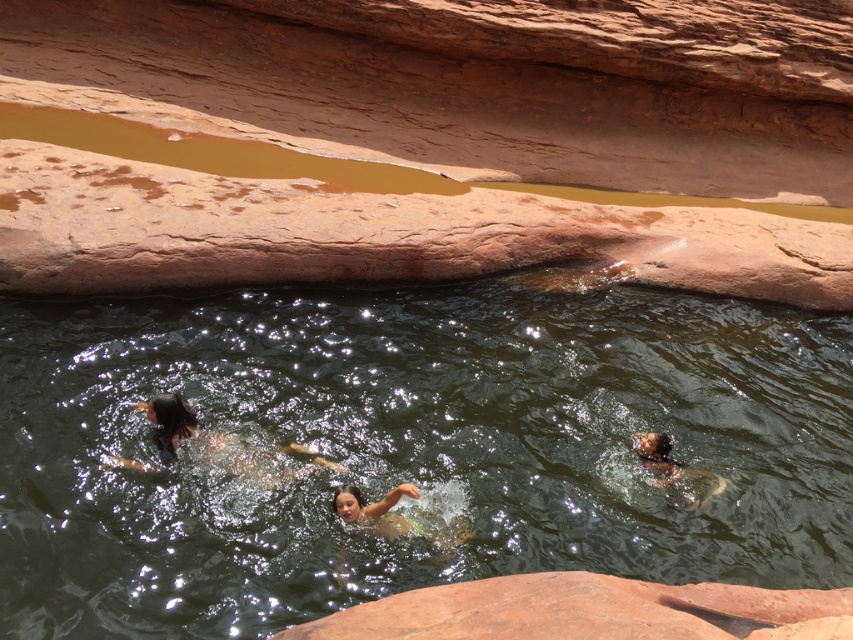
Question: Considering the relative positions of smooth skin person at center and smooth brown skin at lower right in the image provided, where is smooth skin person at center located with respect to smooth brown skin at lower right?

Choices:
 (A) above
 (B) below

Answer: (B)

Question: Which object is closer to the camera taking this photo?

Choices:
 (A) smooth brown skin at lower right
 (B) smooth skin person at center

Answer: (B)

Question: Which point is farther to the camera?

Choices:
 (A) (654, 472)
 (B) (374, 518)
 (C) (717, 433)

Answer: (C)

Question: Among these objects, which one is farthest from the camera?

Choices:
 (A) brown fur dog at center
 (B) smooth skin person at center

Answer: (A)

Question: Is greenish water at center in front of brown fur dog at center?

Choices:
 (A) yes
 (B) no

Answer: (A)

Question: Can you confirm if greenish water at center is positioned to the right of smooth brown skin at lower right?

Choices:
 (A) yes
 (B) no

Answer: (B)